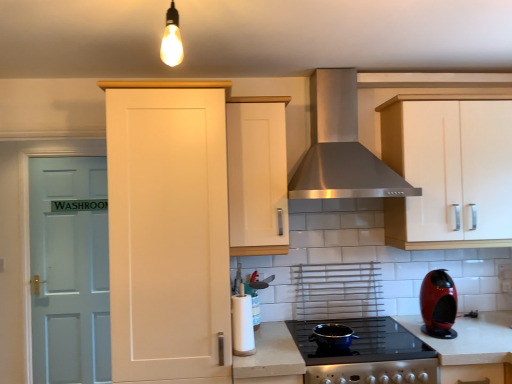
Where is `free point below matte black pot at center, which is the first appliance in right-to-left order (from a real-world perspective)`? free point below matte black pot at center, which is the first appliance in right-to-left order (from a real-world perspective) is located at coordinates pyautogui.click(x=333, y=342).